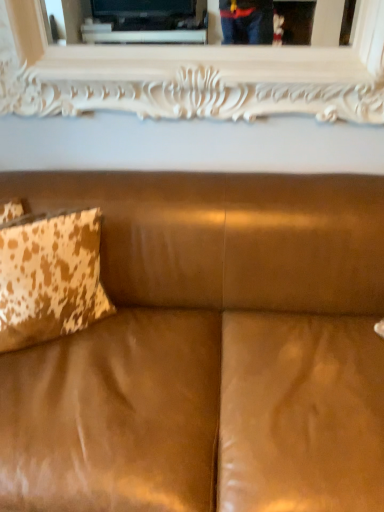
Question: Would you say suede brown couch at center is outside white carved wood picture frame at upper center?

Choices:
 (A) no
 (B) yes

Answer: (B)

Question: Is suede brown couch at center positioned behind white carved wood picture frame at upper center?

Choices:
 (A) no
 (B) yes

Answer: (A)

Question: Can you confirm if suede brown couch at center is bigger than white carved wood picture frame at upper center?

Choices:
 (A) yes
 (B) no

Answer: (A)

Question: From a real-world perspective, is suede brown couch at center physically above white carved wood picture frame at upper center?

Choices:
 (A) yes
 (B) no

Answer: (B)

Question: Is suede brown couch at center thinner than white carved wood picture frame at upper center?

Choices:
 (A) yes
 (B) no

Answer: (B)

Question: Considering the positions of suede brown couch at center and cowhide-patterned pillow at left in the image, is suede brown couch at center taller or shorter than cowhide-patterned pillow at left?

Choices:
 (A) short
 (B) tall

Answer: (B)

Question: In the image, is suede brown couch at center positioned in front of or behind cowhide-patterned pillow at left?

Choices:
 (A) front
 (B) behind

Answer: (A)

Question: Is suede brown couch at center wider or thinner than cowhide-patterned pillow at left?

Choices:
 (A) wide
 (B) thin

Answer: (A)

Question: Is suede brown couch at center spatially inside cowhide-patterned pillow at left, or outside of it?

Choices:
 (A) outside
 (B) inside

Answer: (A)

Question: Is cowhide-patterned pillow at left bigger or smaller than suede brown couch at center?

Choices:
 (A) big
 (B) small

Answer: (B)

Question: In the image, is cowhide-patterned pillow at left on the left side or the right side of suede brown couch at center?

Choices:
 (A) right
 (B) left

Answer: (B)

Question: Is cowhide-patterned pillow at left wider or thinner than suede brown couch at center?

Choices:
 (A) thin
 (B) wide

Answer: (A)

Question: Considering the positions of point (31, 252) and point (162, 300), is point (31, 252) closer or farther from the camera than point (162, 300)?

Choices:
 (A) closer
 (B) farther

Answer: (A)

Question: Do you think white carved wood picture frame at upper center is within suede brown couch at center, or outside of it?

Choices:
 (A) inside
 (B) outside

Answer: (B)

Question: From the image's perspective, is white carved wood picture frame at upper center above or below suede brown couch at center?

Choices:
 (A) below
 (B) above

Answer: (B)